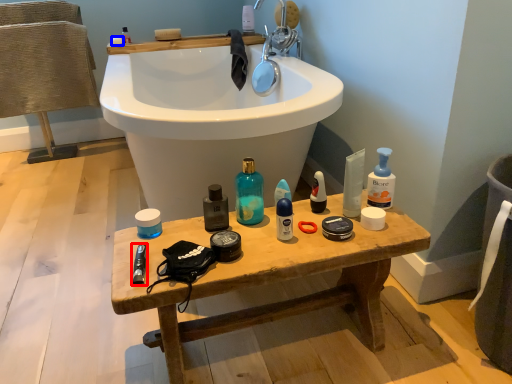
Question: Which object appears farthest to the camera in this image, personal care (highlighted by a red box) or soap (highlighted by a blue box)?

Choices:
 (A) personal care
 (B) soap

Answer: (B)